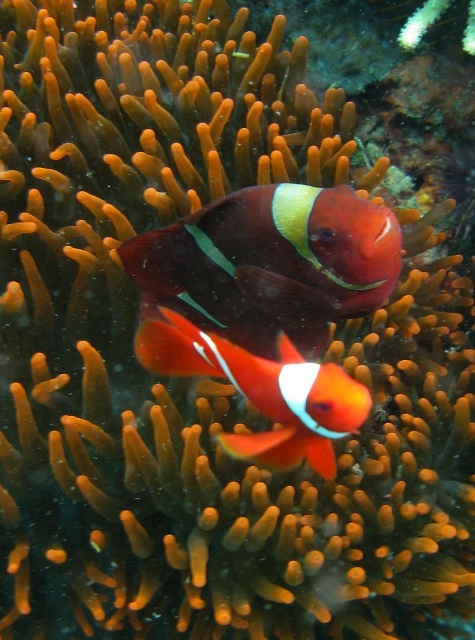
You are a marine biologist observing two clownfish in an underwater scene. You need to determine if they are close enough to interact. The minimum distance required for clownfish interaction is 6 inches. Are the shiny red clownfish at center and the orange matte clownfish at center within this distance?

The distance between the shiny red clownfish at center and the orange matte clownfish at center is 6.47 inches, which is slightly more than the 6 inch requirement. Therefore, they are not close enough to interact.

You are a marine biologist observing an underwater scene with a sea anemone and two clownfish. You notice a specific point at coordinates (269, 262). What is located at this point?

At point (269, 262) lies the shiny red clownfish at center.